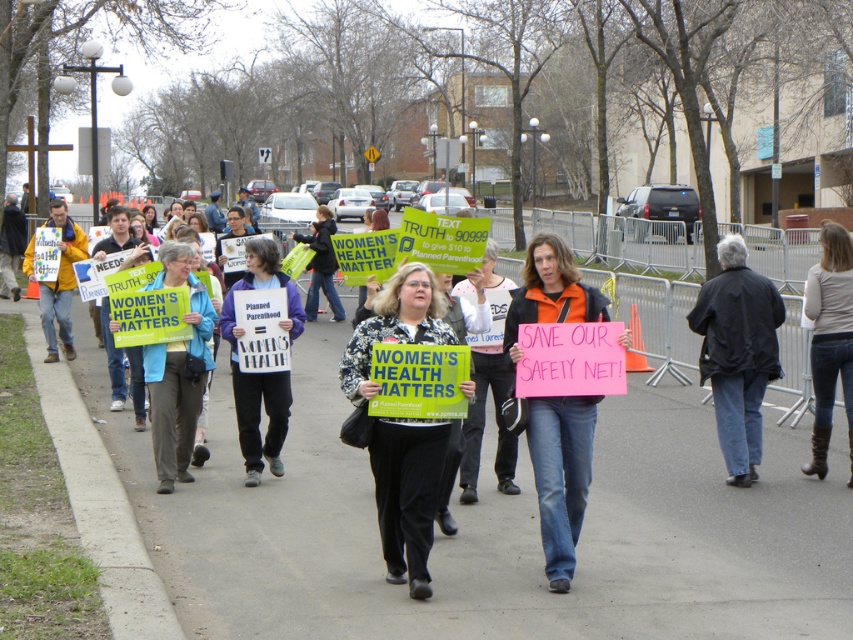
You are a photographer at the protest and want to capture a photo that includes both the black textured coat at center and the denim jeans at lower right. Based on their positions, which object should you focus on first to ensure both are in sharp focus?

The black textured coat at center is closer to the viewer than the denim jeans at lower right. To ensure both are in sharp focus, focus on the black textured coat at center first, as it is the closer object, and use a small aperture for a deeper depth of field.